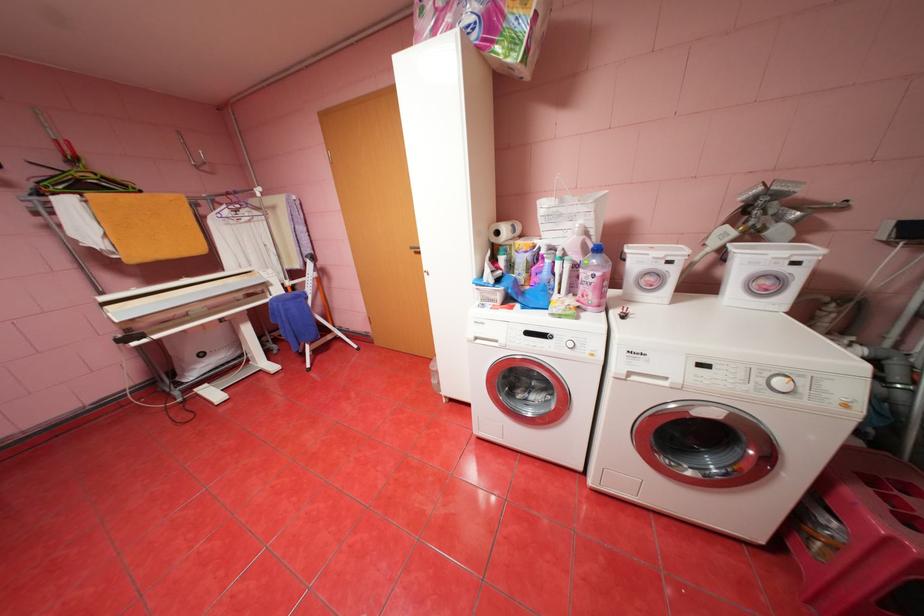
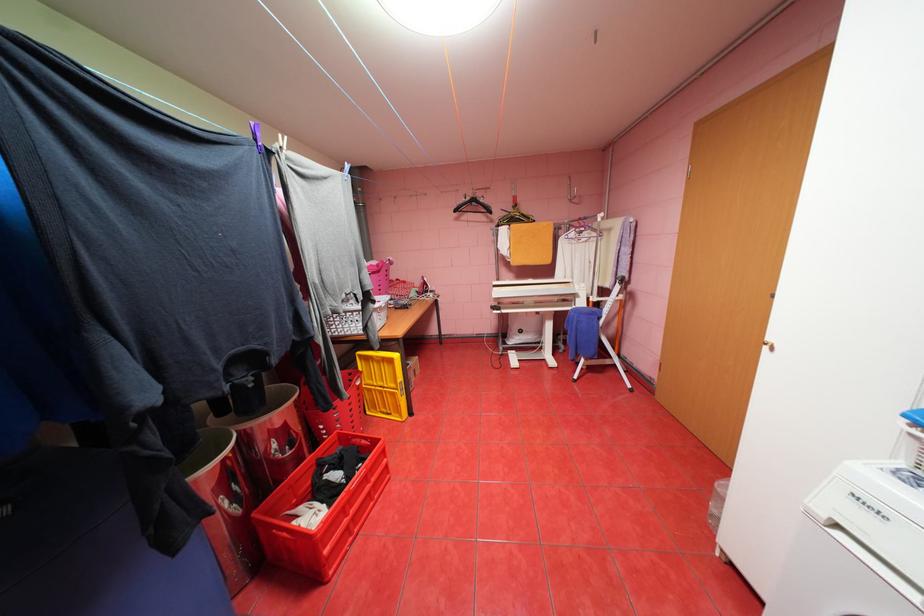
Where in the second image is the point corresponding to point (315, 346) from the first image?

(591, 360)